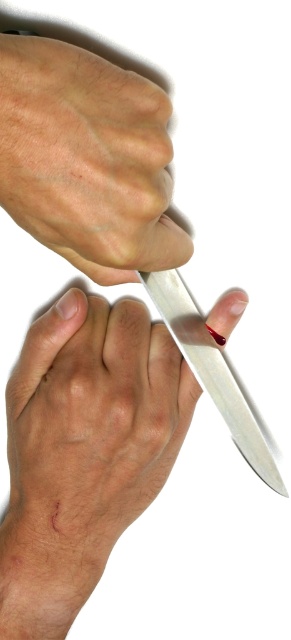
You are a safety inspector checking a kitchen. You notice the smooth skin hand at center and the polished metal knife at lower right. Based on their positions, is there a risk of the hand getting cut by the knife?

The smooth skin hand at center is below the polished metal knife at lower right, so the hand is positioned in a way that could lead to a cut if the knife slips downward. This poses a safety risk.

In the scene shown: You are a safety inspector checking a kitchen. You notice the matte skin hand at upper center and the polished metal knife at lower right. Based on their sizes, which object would be easier to grasp quickly in an emergency?

A: The matte skin hand at upper center is larger in size than the polished metal knife at lower right, so it would be easier to grasp quickly in an emergency.

Based on the scene description, which hand, the smooth skin hand at center or the matte skin hand at upper center, is more likely to be holding the knife?

The smooth skin hand at center is more likely to be holding the knife because it is positioned at the center and the blade is partially covered by the matte skin hand at upper center, which is above the knife.